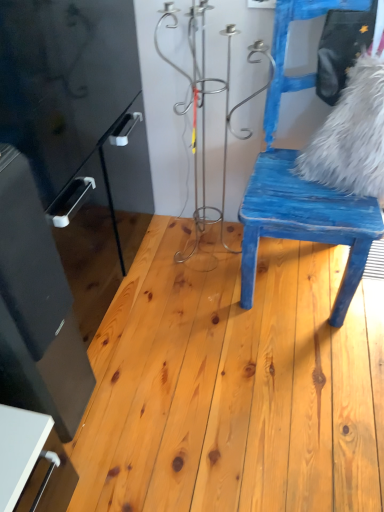
Question: Looking at their shapes, would you say blue distressed wood chair at right is wider or thinner than natural wood floor at center?

Choices:
 (A) wide
 (B) thin

Answer: (B)

Question: Based on their sizes in the image, would you say blue distressed wood chair at right is bigger or smaller than natural wood floor at center?

Choices:
 (A) small
 (B) big

Answer: (B)

Question: Which object is the closest to the white fluffy pillow at upper right?

Choices:
 (A) blue distressed wood chair at right
 (B) natural wood floor at center

Answer: (A)

Question: Estimate the real-world distances between objects in this image. Which object is closer to the blue distressed wood chair at right?

Choices:
 (A) white fluffy pillow at upper right
 (B) natural wood floor at center

Answer: (A)